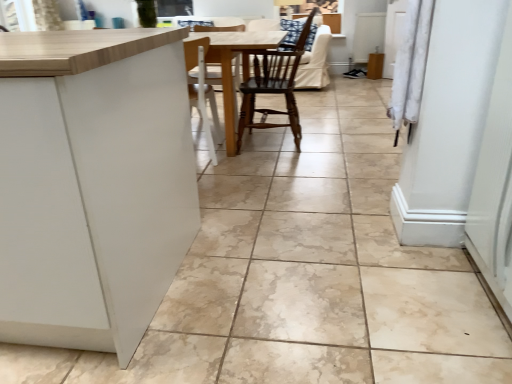
What do you see at coordinates (274, 84) in the screenshot? I see `wooden chair at center` at bounding box center [274, 84].

Locate an element on the screen. This screenshot has height=384, width=512. wooden chair at center is located at coordinates (274, 84).

What do you see at coordinates (231, 67) in the screenshot?
I see `wooden table at center` at bounding box center [231, 67].

The height and width of the screenshot is (384, 512). Find the location of `wooden table at center`. wooden table at center is located at coordinates (231, 67).

This screenshot has width=512, height=384. Find the location of `wooden chair at center`. wooden chair at center is located at coordinates click(x=274, y=84).

Based on their positions, is wooden chair at center located to the left or right of wooden table at center?

Based on their positions, wooden chair at center is located to the right of wooden table at center.

Is wooden chair at center closer to camera compared to wooden table at center?

Result: No.

Is point (251, 121) more distant than point (233, 52)?

That is True.

From the image's perspective, which one is positioned higher, wooden chair at center or wooden table at center?

wooden chair at center.

From a real-world perspective, is wooden chair at center physically below wooden table at center?

No, from a real-world perspective, wooden chair at center is not beneath wooden table at center.

Which object is thinner, wooden chair at center or wooden table at center?

wooden chair at center is thinner.

Is wooden chair at center taller than wooden table at center?

Indeed, wooden chair at center has a greater height compared to wooden table at center.

Considering the relative sizes of wooden chair at center and wooden table at center in the image provided, is wooden chair at center bigger than wooden table at center?

No, wooden chair at center is not bigger than wooden table at center.

Choose the correct answer: Is wooden chair at center inside wooden table at center or outside it?

wooden chair at center is spatially positioned inside wooden table at center.

Does wooden chair at center touch wooden table at center?

wooden chair at center and wooden table at center are clearly separated.

Could you tell me if wooden chair at center is facing wooden table at center?

Yes, wooden chair at center is facing wooden table at center.

This screenshot has height=384, width=512. I want to click on chair that is on the right side of wooden table at center, so click(x=274, y=84).

Does wooden table at center appear on the left side of wooden chair at center?

Yes, wooden table at center is to the left of wooden chair at center.

Is the depth of wooden table at center greater than that of wooden chair at center?

No, wooden table at center is closer to the camera.

Does point (255, 41) lie in front of point (240, 112)?

Yes, it is in front of point (240, 112).

From the image's perspective, does wooden table at center appear lower than wooden chair at center?

Yes.

Consider the image. From a real-world perspective, is wooden table at center on top of wooden chair at center?

No, from a real-world perspective, wooden table at center is not on top of wooden chair at center.

Considering the sizes of wooden table at center and wooden chair at center in the image, is wooden table at center wider or thinner than wooden chair at center?

wooden table at center is wider than wooden chair at center.

Considering the relative sizes of wooden table at center and wooden chair at center in the image provided, is wooden table at center shorter than wooden chair at center?

Yes.

Based on their sizes in the image, would you say wooden table at center is bigger or smaller than wooden chair at center?

wooden table at center is bigger than wooden chair at center.

Can wooden chair at center be found inside wooden table at center?

Yes, wooden chair at center is a part of wooden table at center.

From the picture: Would you say wooden table at center is a long distance from wooden chair at center?

No, wooden table at center is not far away from wooden chair at center.

Is wooden table at center facing towards wooden chair at center?

No, wooden table at center is not aimed at wooden chair at center.

Can you tell me how much wooden table at center and wooden chair at center differ in facing direction?

The angular difference between wooden table at center and wooden chair at center is 88.1 degrees.

Locate an element on the screen. This screenshot has height=384, width=512. chair located behind the wooden table at center is located at coordinates (274, 84).

Find the location of `chair above the wooden table at center (from a real-world perspective)`. chair above the wooden table at center (from a real-world perspective) is located at coordinates (274, 84).

The image size is (512, 384). Find the location of `chair that appears on the right of wooden table at center`. chair that appears on the right of wooden table at center is located at coordinates (274, 84).